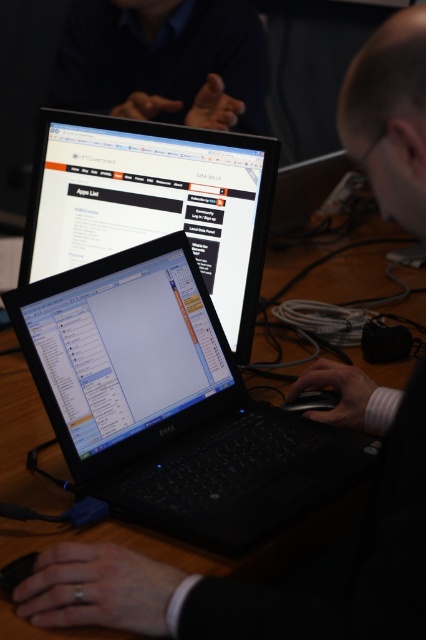
Does black glossy laptop at center appear on the left side of dark blue shirt at upper center?

No, black glossy laptop at center is not to the left of dark blue shirt at upper center.

What do you see at coordinates (121, 346) in the screenshot? Image resolution: width=426 pixels, height=640 pixels. I see `black glossy laptop at center` at bounding box center [121, 346].

Does point (212, 387) come farther from viewer compared to point (126, 8)?

No, it is not.

The width and height of the screenshot is (426, 640). In order to click on black glossy laptop at center in this screenshot , I will do tap(121, 346).

Between matte black laptop at center and dark blue shirt at upper center, which one has less height?

dark blue shirt at upper center

Does matte black laptop at center have a lesser width compared to dark blue shirt at upper center?

Indeed, matte black laptop at center has a lesser width compared to dark blue shirt at upper center.

Identify the location of matte black laptop at center. (152, 202).

Based on the photo, is black matte laptop at center positioned at the back of black glossy laptop at center?

No.

Is point (54, 328) positioned before point (112, 294)?

Yes, it is in front of point (112, 294).

Identify the location of black matte laptop at center. This screenshot has height=640, width=426. (169, 403).